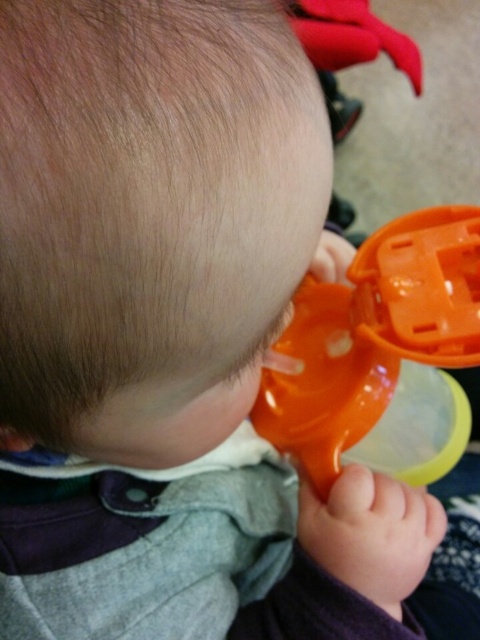
You are a caregiver holding a baby who is trying to drink from both the orange plastic sippy cup at lower right and the rubberized plastic sippy cup at upper center. Which cup is narrower?

The orange plastic sippy cup at lower right has a lesser width compared to the rubberized plastic sippy cup at upper center, so the orange plastic sippy cup at lower right is narrower.

You are a caregiver trying to clean the baby bottles. You see the orange plastic sippy cup at lower right and the rubberized plastic sippy cup at upper center. Which one is located lower in the image?

The orange plastic sippy cup at lower right is located lower in the image than the rubberized plastic sippy cup at upper center.